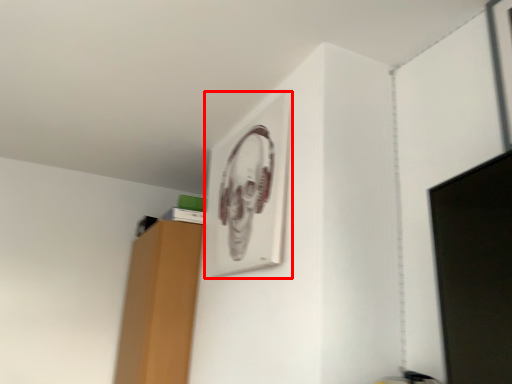
Question: Observing the image, what is the correct spatial positioning of picture frame (annotated by the red box) in reference to computer monitor?

Choices:
 (A) left
 (B) right

Answer: (A)